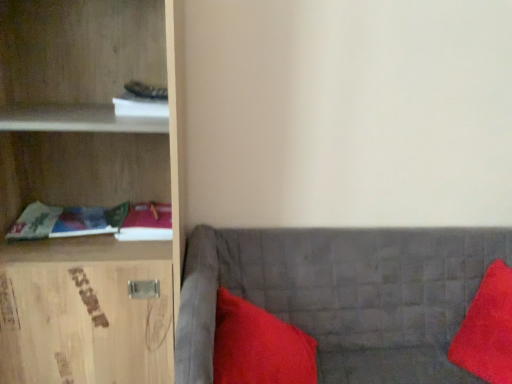
Question: Should I look upward or downward to see matte fabric book at left, arranged as the 3th book when viewed from the top?

Choices:
 (A) down
 (B) up

Answer: (A)

Question: Is velvet red pillow at right, the second pillow viewed from the left, a part of matte fabric book at left, arranged as the 3th book when viewed from the top?

Choices:
 (A) yes
 (B) no

Answer: (B)

Question: Does matte fabric book at left, arranged as the 3th book when viewed from the top, appear on the left side of velvet red pillow at right, placed as the 1th pillow when sorted from right to left?

Choices:
 (A) yes
 (B) no

Answer: (A)

Question: From a real-world perspective, is matte fabric book at left, the first book in the bottom-to-top sequence, on velvet red pillow at right, the second pillow viewed from the left?

Choices:
 (A) yes
 (B) no

Answer: (A)

Question: Is matte fabric book at left, arranged as the 3th book when viewed from the top, far from velvet red pillow at right, the second pillow viewed from the left?

Choices:
 (A) no
 (B) yes

Answer: (B)

Question: From a real-world perspective, is matte fabric book at left, arranged as the 3th book when viewed from the top, under velvet red pillow at right, placed as the 1th pillow when sorted from right to left?

Choices:
 (A) yes
 (B) no

Answer: (B)

Question: From the image's perspective, is matte fabric book at left, arranged as the 3th book when viewed from the top, beneath velvet red pillow at right, the second pillow viewed from the left?

Choices:
 (A) yes
 (B) no

Answer: (B)

Question: Does satin red pillow at lower right, acting as the first pillow starting from the left, have a larger size compared to matte fabric book at left, the first book in the bottom-to-top sequence?

Choices:
 (A) no
 (B) yes

Answer: (B)

Question: Considering the relative positions of satin red pillow at lower right, acting as the first pillow starting from the left, and matte fabric book at left, the first book in the bottom-to-top sequence, in the image provided, is satin red pillow at lower right, acting as the first pillow starting from the left, to the right of matte fabric book at left, the first book in the bottom-to-top sequence, from the viewer's perspective?

Choices:
 (A) yes
 (B) no

Answer: (A)

Question: Are satin red pillow at lower right, which is the 2th pillow from right to left, and matte fabric book at left, arranged as the 3th book when viewed from the top, beside each other?

Choices:
 (A) no
 (B) yes

Answer: (A)

Question: Is matte fabric book at left, the first book in the bottom-to-top sequence, at the back of satin red pillow at lower right, acting as the first pillow starting from the left?

Choices:
 (A) no
 (B) yes

Answer: (A)

Question: From the image's perspective, is satin red pillow at lower right, acting as the first pillow starting from the left, beneath matte fabric book at left, the first book in the bottom-to-top sequence?

Choices:
 (A) no
 (B) yes

Answer: (B)

Question: Is satin red pillow at lower right, which is the 2th pillow from right to left, to the left of matte fabric book at left, the first book in the bottom-to-top sequence, from the viewer's perspective?

Choices:
 (A) no
 (B) yes

Answer: (A)

Question: Are velvet red pillow at right, placed as the 1th pillow when sorted from right to left, and velvet grey couch at lower right making contact?

Choices:
 (A) no
 (B) yes

Answer: (A)